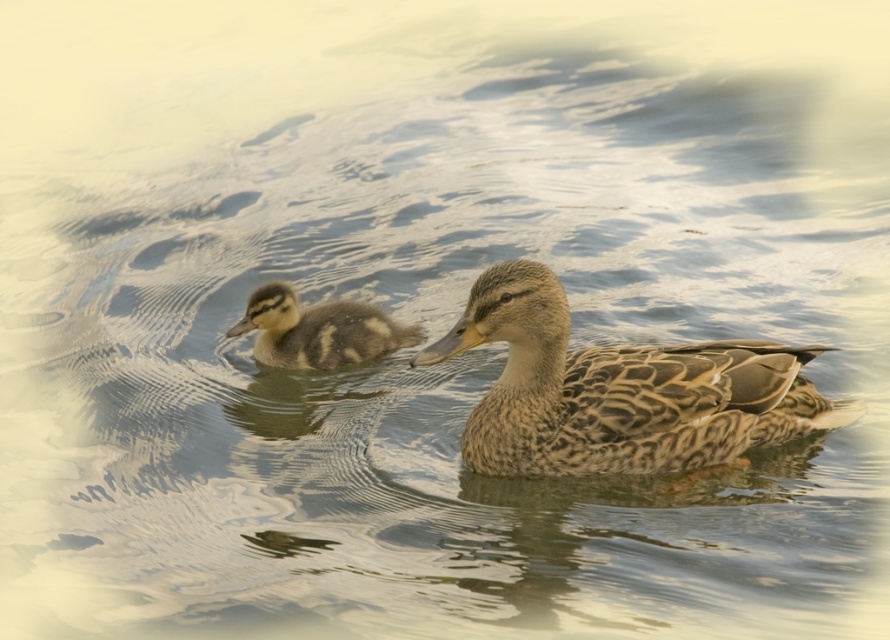
You are observing two points in the image, point (535, 348) and point (312, 353). Which point is closer to you?

Point (535, 348) is closer to the camera than point (312, 353).